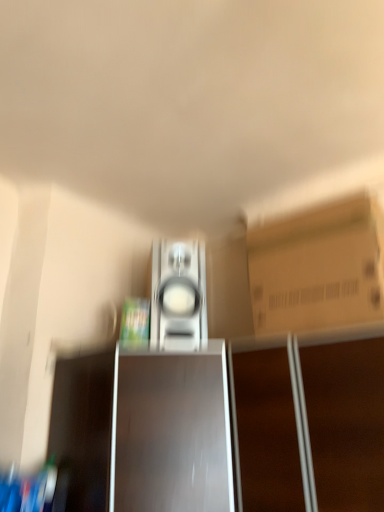
Question: Considering the positions of satin silver speaker at center and shiny brown cabinet at center in the image, is satin silver speaker at center taller or shorter than shiny brown cabinet at center?

Choices:
 (A) tall
 (B) short

Answer: (B)

Question: In the image, is satin silver speaker at center positioned in front of or behind shiny brown cabinet at center?

Choices:
 (A) front
 (B) behind

Answer: (B)

Question: Which object is positioned closest to the shiny brown cabinet at center?

Choices:
 (A) satin silver speaker at center
 (B) brown cardboard box at upper right

Answer: (A)

Question: Estimate the real-world distances between objects in this image. Which object is farther from the shiny brown cabinet at center?

Choices:
 (A) satin silver speaker at center
 (B) brown cardboard box at upper right

Answer: (B)